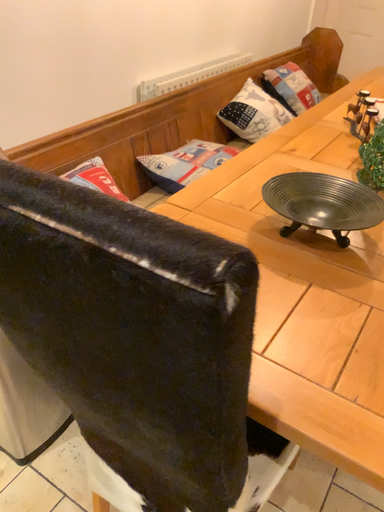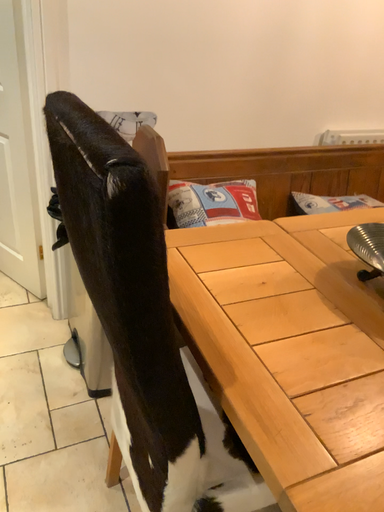
Question: Which way did the camera rotate in the video?

Choices:
 (A) rotated downward
 (B) rotated upward

Answer: (B)